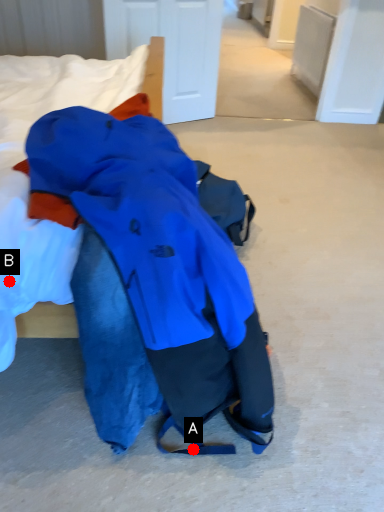
Question: Two points are circled on the image, labeled by A and B beside each circle. Among these points, which one is nearest to the camera?

Choices:
 (A) A is closer
 (B) B is closer

Answer: (B)